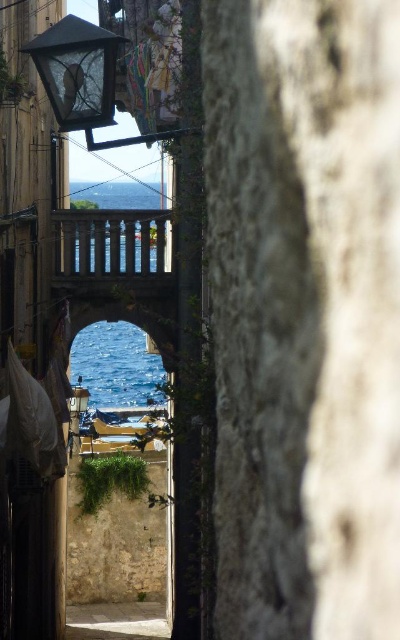
Who is positioned more to the left, blue glass water at upper center or matte glass lamp at center?

blue glass water at upper center

Does blue glass water at upper center appear on the left side of matte glass lamp at center?

Yes, blue glass water at upper center is to the left of matte glass lamp at center.

Which is in front, point (120, 189) or point (86, 408)?

Positioned in front is point (86, 408).

I want to click on blue glass water at upper center, so click(116, 195).

Can you confirm if matte glass lamp at upper left is wider than blue water at center?

Incorrect, matte glass lamp at upper left's width does not surpass blue water at center's.

Does matte glass lamp at upper left appear on the left side of blue water at center?

Incorrect, matte glass lamp at upper left is not on the left side of blue water at center.

Where is `matte glass lamp at upper left`? The height and width of the screenshot is (640, 400). matte glass lamp at upper left is located at coordinates (78, 72).

Identify the location of matte glass lamp at upper left. pos(78,72).

Which is above, stone balustrade at center or blue glass water at upper center?

blue glass water at upper center is higher up.

Can you confirm if stone balustrade at center is positioned to the right of blue glass water at upper center?

Correct, you'll find stone balustrade at center to the right of blue glass water at upper center.

Between point (130, 280) and point (84, 188), which one is positioned behind?

Point (84, 188)

The image size is (400, 640). Find the location of `stone balustrade at center`. stone balustrade at center is located at coordinates (110, 248).